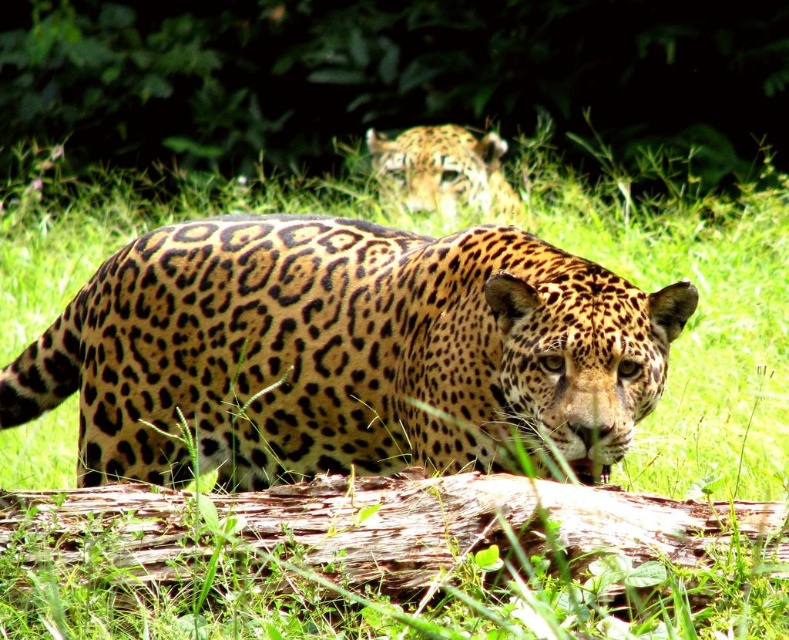
Who is lower down, spotted fur jaguar at center or spotted fur jaguar at upper center?

spotted fur jaguar at center is below.

Is spotted fur jaguar at center bigger than spotted fur jaguar at upper center?

Yes.

Is point (432, 326) closer to camera compared to point (414, 166)?

Yes.

Identify the location of spotted fur jaguar at center. (343, 352).